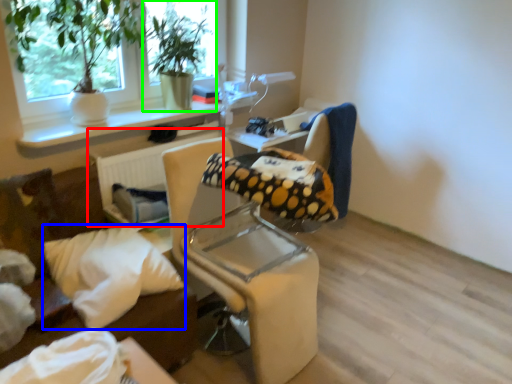
Question: Which object is positioned closest to radiator (highlighted by a red box)? Select from pillow (highlighted by a blue box) and houseplant (highlighted by a green box).

Choices:
 (A) pillow
 (B) houseplant

Answer: (B)